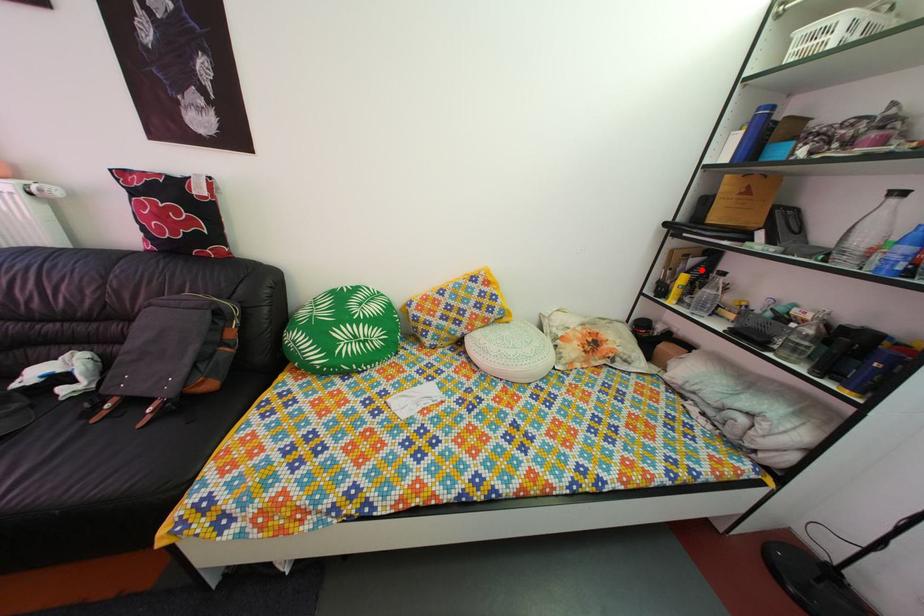
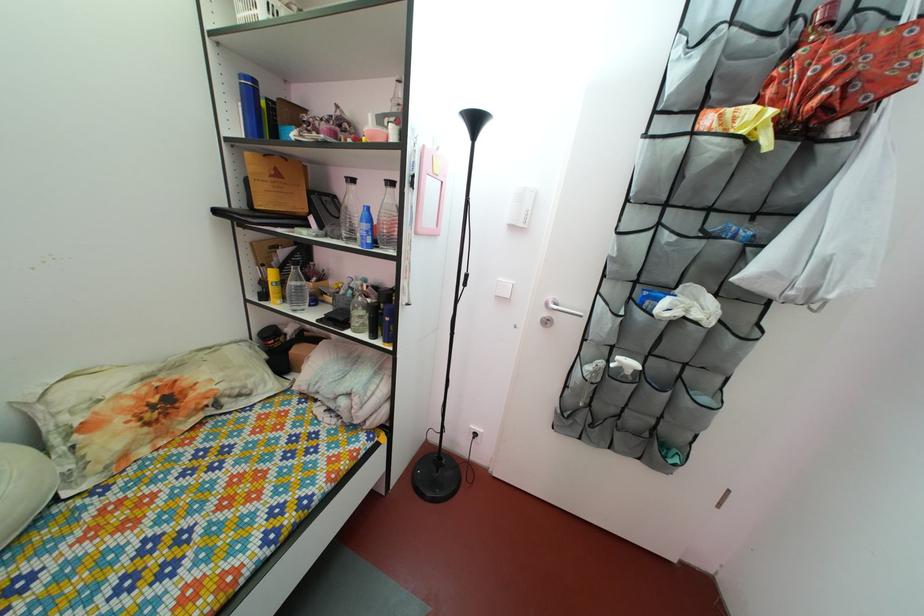
Where in the second image is the point corresponding to the highlighted location from the first image?

(292, 262)